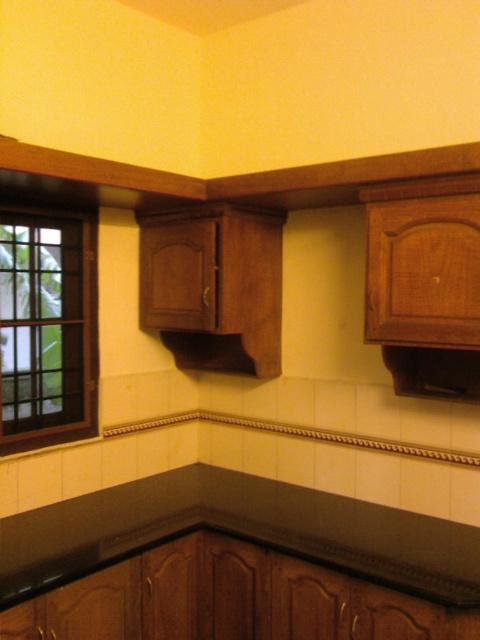
Question: Which object appears closest to the camera in this image?

Choices:
 (A) brown wooden window at left
 (B) black laminate counter top at upper center

Answer: (B)

Question: Does black laminate counter top at upper center appear on the right side of brown wooden window at left?

Choices:
 (A) yes
 (B) no

Answer: (A)

Question: Is black laminate counter top at upper center behind brown wooden window at left?

Choices:
 (A) yes
 (B) no

Answer: (B)

Question: Which of the following is the farthest from the observer?

Choices:
 (A) (260, 508)
 (B) (87, 339)

Answer: (B)

Question: Does black laminate counter top at upper center appear on the left side of brown wooden window at left?

Choices:
 (A) no
 (B) yes

Answer: (A)